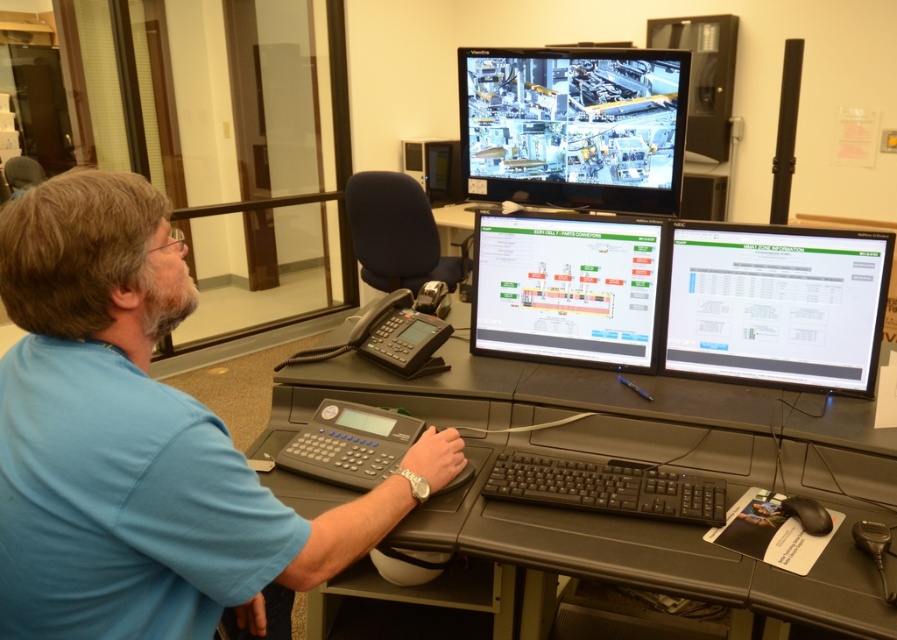
Question: Which object appears farthest from the camera in this image?

Choices:
 (A) white glossy monitor at center
 (B) black glossy monitor at upper center

Answer: (B)

Question: Which of these objects is positioned closest to the blue fabric shirt at center?

Choices:
 (A) white glossy monitor at center
 (B) black plastic computer desk at center
 (C) black plastic keyboard at center

Answer: (B)

Question: Is matte black monitor at upper center positioned in front of white glossy monitor at center?

Choices:
 (A) yes
 (B) no

Answer: (B)

Question: Which point is closer to the camera?

Choices:
 (A) (624, 228)
 (B) (417, 170)
 (C) (512, 483)

Answer: (C)

Question: Is white glossy monitor at center above black glossy monitor at upper center?

Choices:
 (A) no
 (B) yes

Answer: (A)

Question: Does blue fabric shirt at center appear on the left side of matte black monitor at upper center?

Choices:
 (A) yes
 (B) no

Answer: (A)